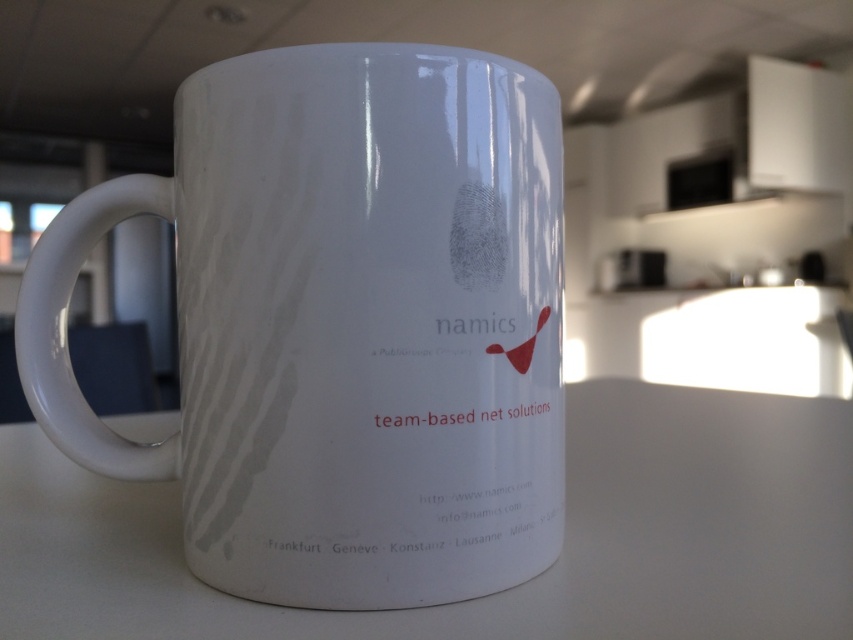
Question: Is glossy ceramic mug at center below white matte counter top at center?

Choices:
 (A) yes
 (B) no

Answer: (B)

Question: In this image, where is glossy ceramic mug at center located relative to white matte counter top at center?

Choices:
 (A) below
 (B) above

Answer: (B)

Question: Among these objects, which one is farthest from the camera?

Choices:
 (A) white matte counter top at center
 (B) glossy ceramic mug at center

Answer: (B)

Question: Is the position of glossy ceramic mug at center less distant than that of white matte counter top at center?

Choices:
 (A) no
 (B) yes

Answer: (A)

Question: Which point appears closest to the camera in this image?

Choices:
 (A) (523, 604)
 (B) (270, 438)

Answer: (B)